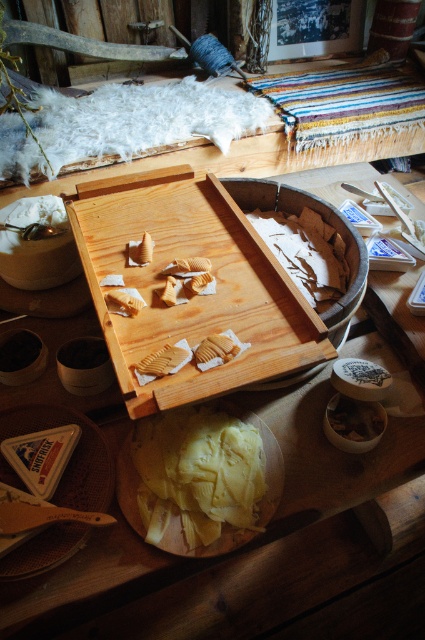
Is white crumbly food at center behind wooden carved piece at center?

That is True.

This screenshot has width=425, height=640. What are the coordinates of `white crumbly food at center` in the screenshot? It's located at (306, 252).

Is white creamy cheese at lower center positioned at the back of wooden carved piece at center?

That is True.

Who is more forward, (x=348, y=426) or (x=178, y=362)?

Positioned in front is point (x=178, y=362).

Image resolution: width=425 pixels, height=640 pixels. Identify the location of white creamy cheese at lower center. (354, 417).

Is white creamy cheese at lower center shorter than golden textured cookie at center?

No, white creamy cheese at lower center is not shorter than golden textured cookie at center.

Which of these two, white creamy cheese at lower center or golden textured cookie at center, stands shorter?

golden textured cookie at center

The height and width of the screenshot is (640, 425). Identify the location of white creamy cheese at lower center. click(x=354, y=417).

This screenshot has width=425, height=640. Find the location of `white creamy cheese at lower center`. white creamy cheese at lower center is located at coordinates (354, 417).